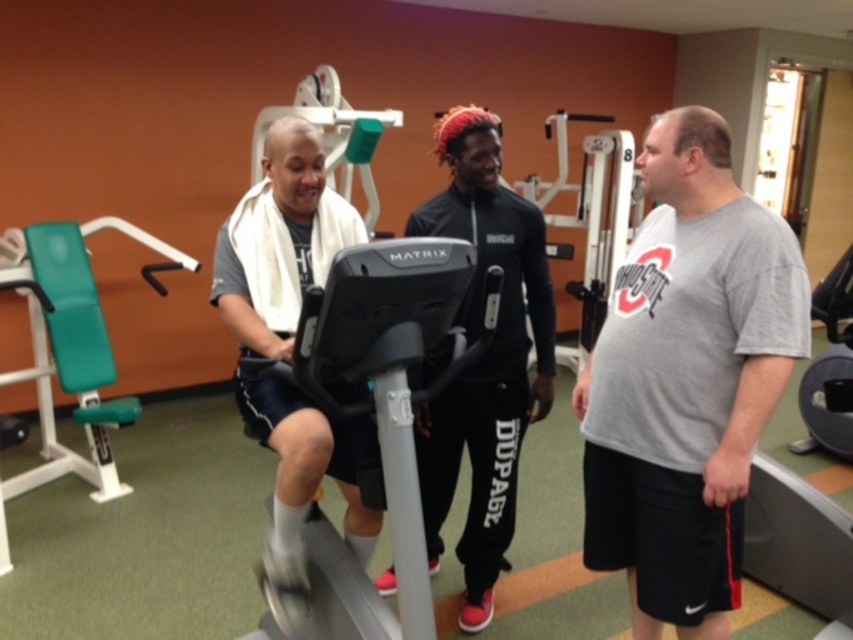
Question: Estimate the real-world distances between objects in this image. Which object is farther from the gray cotton t-shirt at center?

Choices:
 (A) black matte track pants at center
 (B) black plastic elliptical at center
 (C) gray matte/soft exercise bike at center

Answer: (C)

Question: In this image, where is gray cotton t-shirt at center located relative to black plastic elliptical at center?

Choices:
 (A) above
 (B) below

Answer: (A)

Question: Which of these objects is positioned farthest from the gray matte/soft exercise bike at center?

Choices:
 (A) gray cotton t-shirt at center
 (B) black matte track pants at center
 (C) black plastic elliptical at center

Answer: (A)

Question: Is gray cotton t-shirt at center to the left of black plastic elliptical at center from the viewer's perspective?

Choices:
 (A) no
 (B) yes

Answer: (A)

Question: Does gray cotton t-shirt at center appear over black plastic elliptical at center?

Choices:
 (A) yes
 (B) no

Answer: (A)

Question: Which point is closer to the camera taking this photo?

Choices:
 (A) (483, 387)
 (B) (265, 145)
 (C) (416, 600)

Answer: (C)